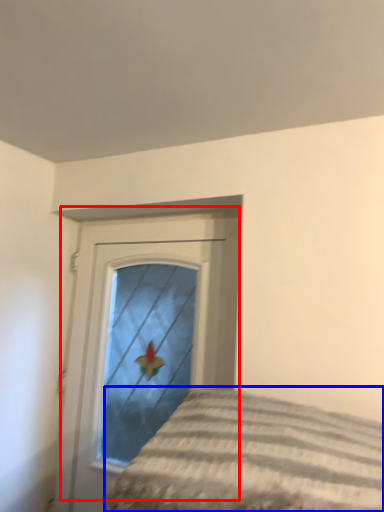
Question: Among these objects, which one is farthest to the camera, door (highlighted by a red box) or bed (highlighted by a blue box)?

Choices:
 (A) door
 (B) bed

Answer: (A)